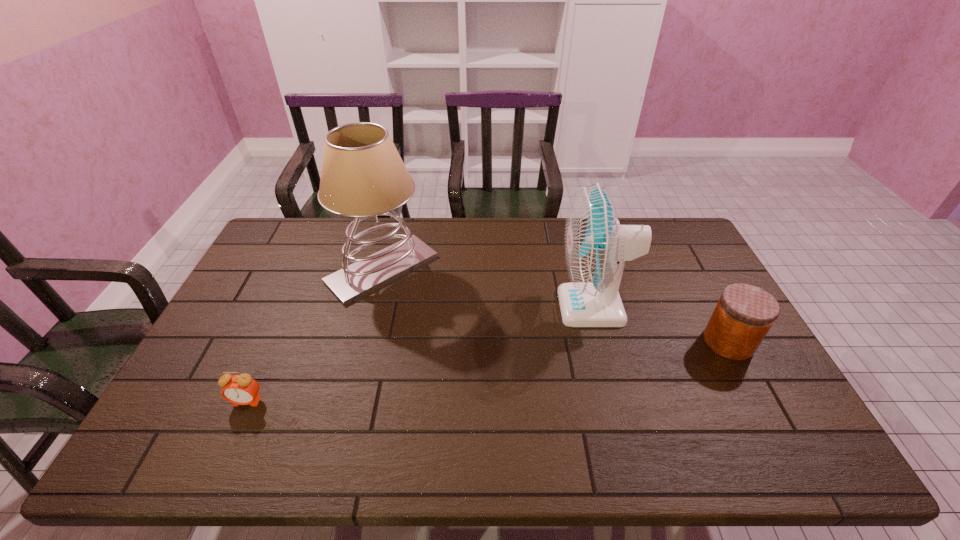
At what (x,y) coordinates should I click in order to perform the action: click on free spot located 0.380m in front of the second object from right to left to face the airflow. Please return your answer as a coordinate pair (x, y). This screenshot has height=540, width=960. Looking at the image, I should click on click(x=435, y=307).

Identify the location of free point located in front of the second object from right to left to face the airflow. [x=484, y=307].

This screenshot has width=960, height=540. What are the coordinates of `blank space located 0.170m on the back of the jar` in the screenshot? It's located at (698, 285).

Identify the location of vacant space located 0.080m on the face of the alarm clock. (230, 438).

What are the coordinates of `object that is at the far edge` in the screenshot? It's located at (363, 175).

Identify the location of object at the left edge. (239, 389).

Locate an element on the screen. The width and height of the screenshot is (960, 540). object at the right edge is located at coordinates (744, 314).

The width and height of the screenshot is (960, 540). In the image, there is a desktop. Identify the location of vacant space at the far edge. (466, 237).

The image size is (960, 540). I want to click on vacant space at the left edge of the desktop, so click(x=182, y=384).

This screenshot has width=960, height=540. Find the location of `vacant space at the near right corner`. vacant space at the near right corner is located at coordinates (768, 464).